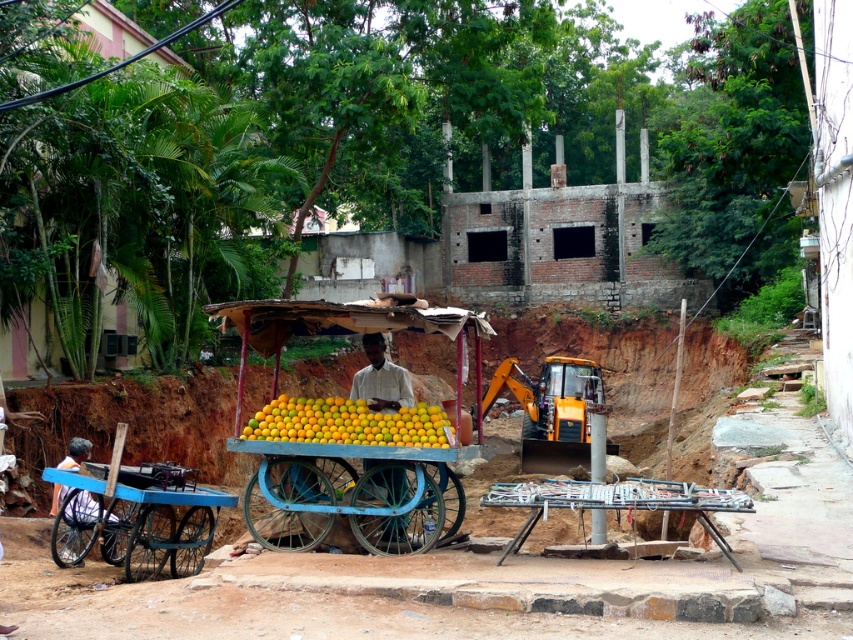
Question: Does wooden cart at center appear under white matte man at center?

Choices:
 (A) yes
 (B) no

Answer: (A)

Question: Can you confirm if wooden cart at center is wider than yellow matte oranges at center?

Choices:
 (A) no
 (B) yes

Answer: (B)

Question: Estimate the real-world distances between objects in this image. Which object is closer to the white matte man at center?

Choices:
 (A) metallic silver grill at lower center
 (B) blue painted wood cart at lower left
 (C) wooden cart at center

Answer: (C)

Question: Which point appears farthest from the camera in this image?

Choices:
 (A) (334, 449)
 (B) (396, 381)

Answer: (B)

Question: Can you confirm if blue painted wood cart at lower left is positioned above metallic silver grill at lower center?

Choices:
 (A) yes
 (B) no

Answer: (B)

Question: Which of the following is the closest to the observer?

Choices:
 (A) (180, 500)
 (B) (543, 484)

Answer: (B)